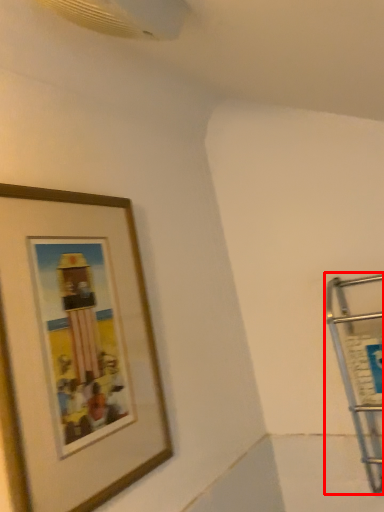
Question: Considering the relative positions of cart (annotated by the red box) and picture frame in the image provided, where is cart (annotated by the red box) located with respect to the staircase?

Choices:
 (A) right
 (B) left

Answer: (A)